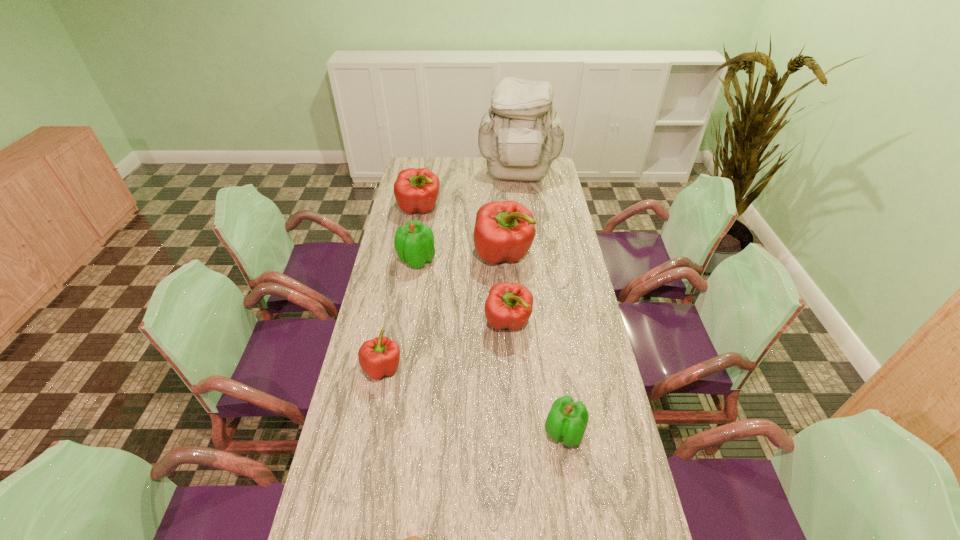
I want to click on blank space located on the right of the nearest pink bell pepper, so click(x=434, y=368).

This screenshot has width=960, height=540. I want to click on object positioned at the far edge, so click(x=521, y=134).

At what (x,y) coordinates should I click in order to perform the action: click on backpack that is positioned at the right edge. Please return your answer as a coordinate pair (x, y). The width and height of the screenshot is (960, 540). Looking at the image, I should click on (521, 134).

Locate an element on the screen. bell pepper positioned at the right edge is located at coordinates (567, 420).

Locate an element on the screen. The width and height of the screenshot is (960, 540). object that is at the far right corner is located at coordinates (521, 134).

Where is `free space at the left edge of the desktop`? The width and height of the screenshot is (960, 540). free space at the left edge of the desktop is located at coordinates (357, 357).

Identify the location of vacant area at the right edge. The height and width of the screenshot is (540, 960). (572, 246).

Locate an element on the screen. This screenshot has height=540, width=960. blank space at the far left corner of the desktop is located at coordinates (434, 159).

What are the coordinates of `free spot between the nearest bell pepper and the farthest object` in the screenshot? It's located at (541, 305).

Locate an element on the screen. This screenshot has height=540, width=960. vacant area that lies between the farthest pink bell pepper and the tallest bell pepper is located at coordinates (461, 232).